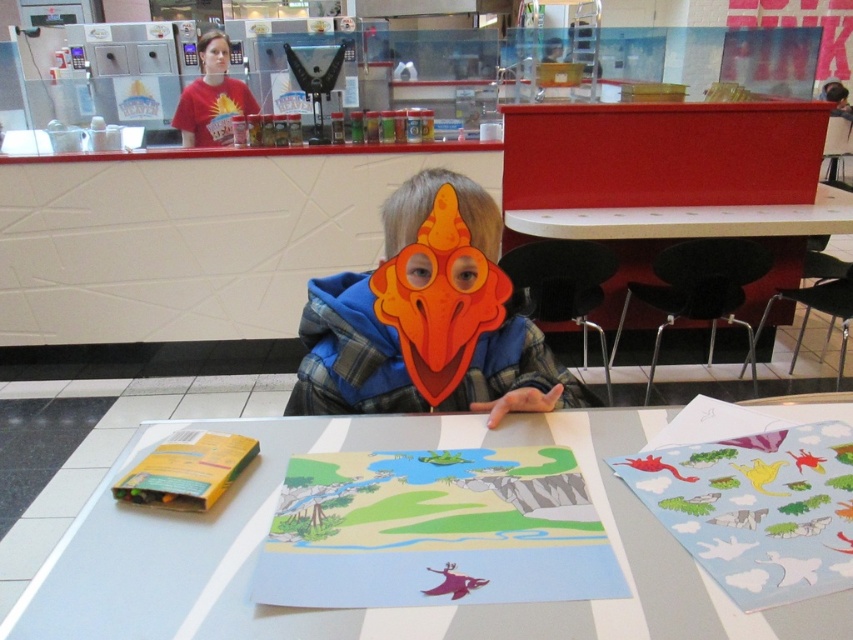
Question: Does white glossy table at center appear under orange paper mask at center?

Choices:
 (A) no
 (B) yes

Answer: (B)

Question: Can you confirm if white glossy table at center is positioned below orange paper mask at center?

Choices:
 (A) no
 (B) yes

Answer: (B)

Question: Which point appears closest to the camera in this image?

Choices:
 (A) (332, 422)
 (B) (352, 337)

Answer: (A)

Question: Which point is closer to the camera?

Choices:
 (A) [524, 339]
 (B) [619, 564]

Answer: (B)

Question: Among these points, which one is nearest to the camera?

Choices:
 (A) [334, 310]
 (B) [244, 513]

Answer: (B)

Question: Considering the relative positions of white glossy table at center and orange paper mask at center in the image provided, where is white glossy table at center located with respect to orange paper mask at center?

Choices:
 (A) above
 (B) below

Answer: (B)